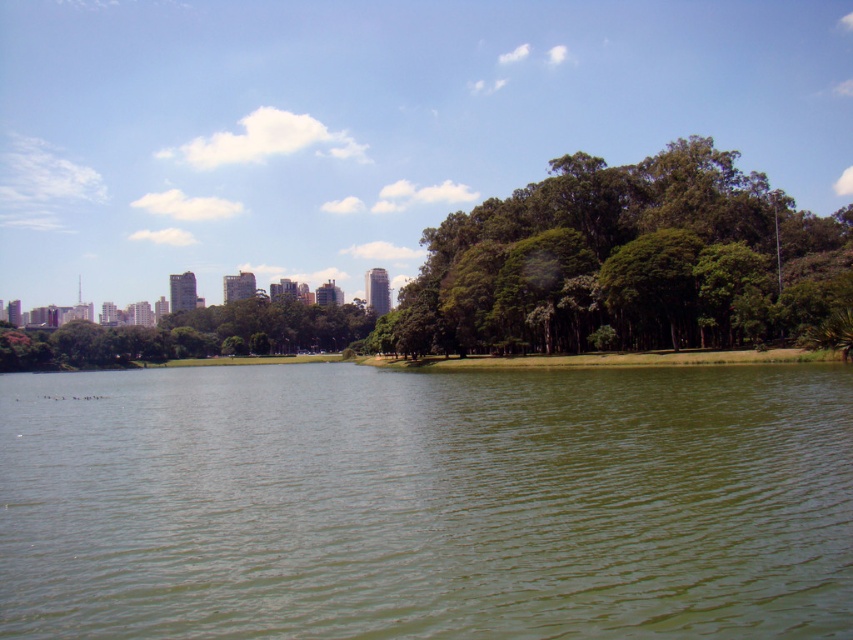
Can you confirm if green leafy trees at center is wider than green leafy tree at center?

In fact, green leafy trees at center might be narrower than green leafy tree at center.

Does green leafy trees at center appear on the right side of green leafy tree at center?

Correct, you'll find green leafy trees at center to the right of green leafy tree at center.

Who is more distant from viewer, (646, 323) or (94, 346)?

Positioned behind is point (94, 346).

Find the location of a particular element. green leafy trees at center is located at coordinates (625, 260).

Is point (264, 608) positioned in front of point (787, 316)?

Yes, it is.

Can you confirm if green water at center is bigger than green leafy trees at center?

No.

Identify the location of green water at center. This screenshot has width=853, height=640. (426, 502).

Is green water at center thinner than green leafy tree at center?

Yes, green water at center is thinner than green leafy tree at center.

Locate an element on the screen. Image resolution: width=853 pixels, height=640 pixels. green water at center is located at coordinates (426, 502).